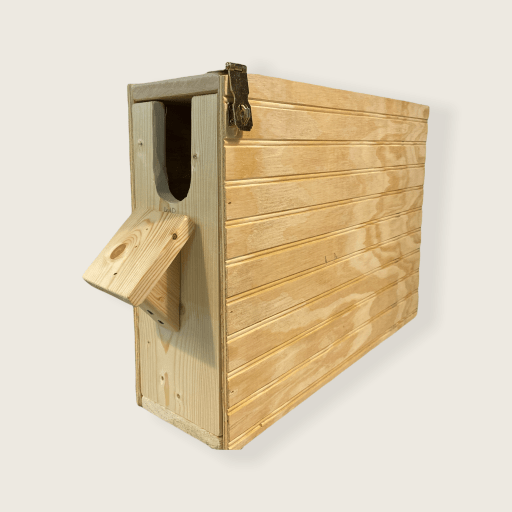
Find the location of a particular element. The width and height of the screenshot is (512, 512). latch is located at coordinates (238, 87).